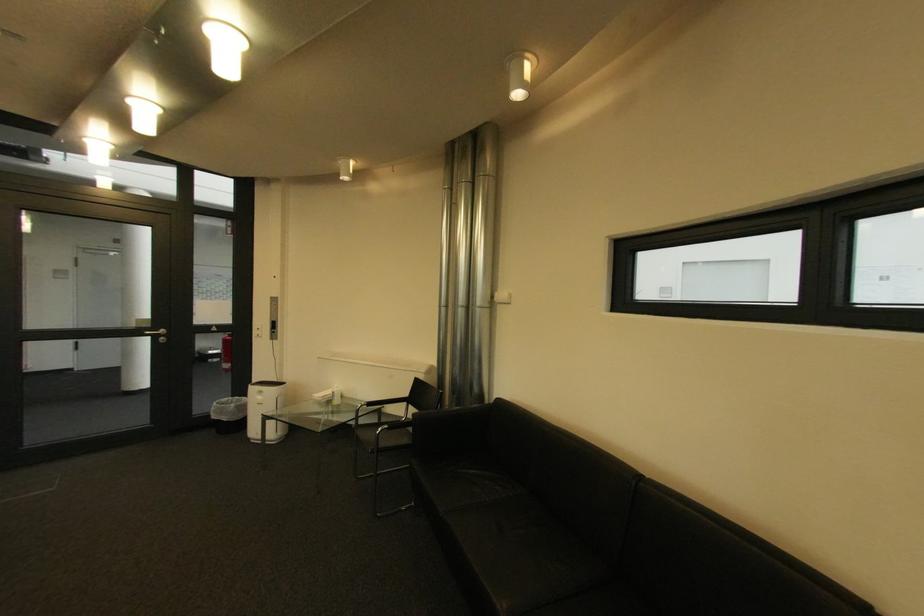
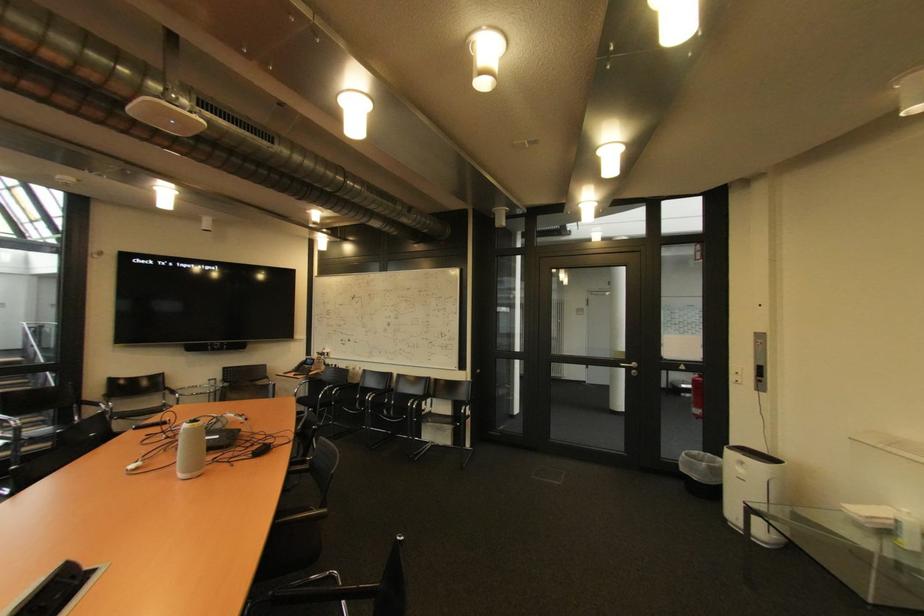
Find the pixel in the second image that matches point (163, 339) in the first image.

(637, 371)